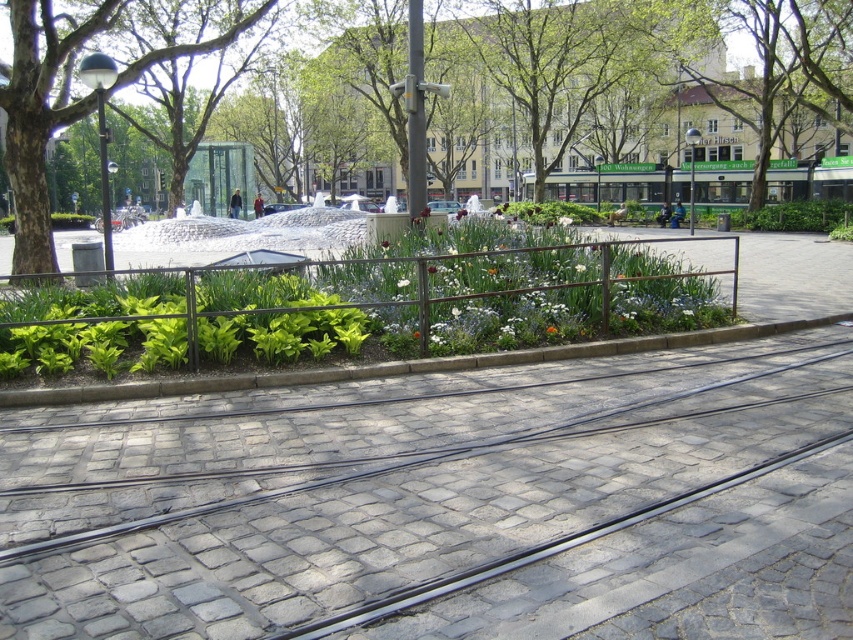
You are standing at the tram tracks on the cobblestone street. Looking towards the flower bed, where is the green leafy tree at center located relative to your position?

The green leafy tree at center is located at point 0.119 on the x axis and 0.641 on the y axis relative to your position.

You are standing at the center of the cobblestone street with tram tracks and want to reach the green leafy tree at left. Which direction should you walk to get there?

The green leafy tree at left is located at point (41,115), so you should walk towards the left side of the street to reach it.

You are standing in the urban park and want to walk from the cobblestone street to the flower bed. There are two points marked on the path. Which point is closer to you, point (x=7, y=124) or point (x=796, y=93)?

Point (x=7, y=124) is closer to the viewer than point (x=796, y=93).